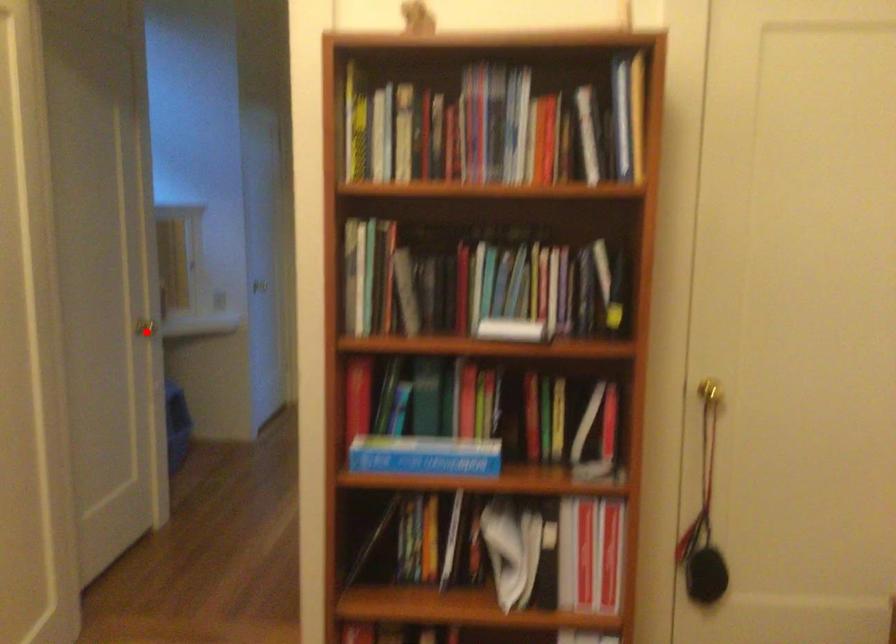
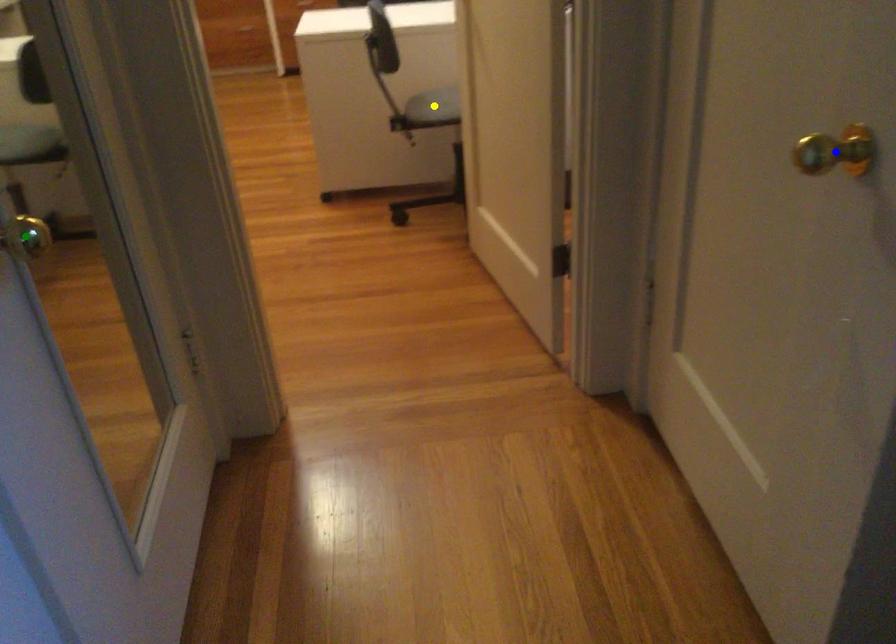
Question: I am providing you with two images of the same scene from different viewpoints. A red point is marked on the first image. You are given multiple points on the second image. Which point in image 2 is actually the same real-world point as the red point in image 1?

Choices:
 (A) green point
 (B) yellow point
 (C) blue point

Answer: (C)